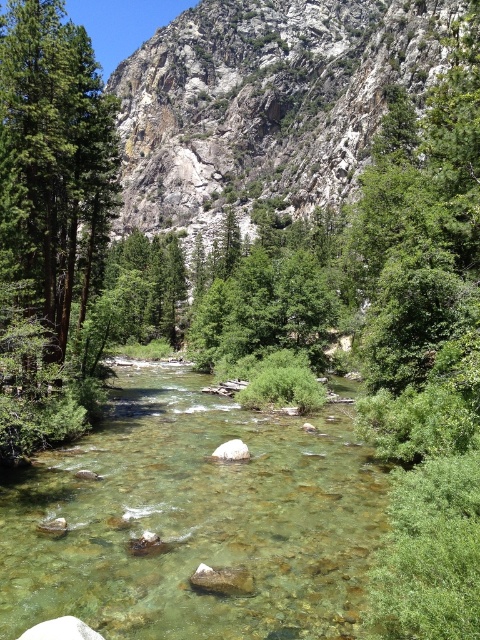
Question: Which of the following is the closest to the observer?

Choices:
 (A) (50, 136)
 (B) (285, 630)

Answer: (B)

Question: Can you confirm if clear glass river at center is positioned to the right of green matte tree at left?

Choices:
 (A) no
 (B) yes

Answer: (B)

Question: Can you confirm if clear glass river at center is positioned above green matte tree at left?

Choices:
 (A) yes
 (B) no

Answer: (B)

Question: Among these points, which one is nearest to the camera?

Choices:
 (A) (189, 634)
 (B) (110, 186)

Answer: (A)

Question: Is clear glass river at center above green matte tree at left?

Choices:
 (A) no
 (B) yes

Answer: (A)